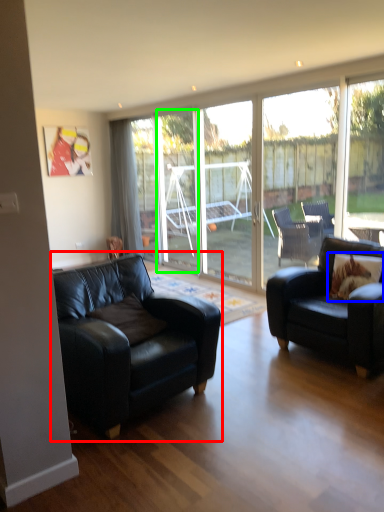
Question: Which object is positioned farthest from studio couch (highlighted by a red box)? Select from pillow (highlighted by a blue box) and glass door (highlighted by a green box).

Choices:
 (A) pillow
 (B) glass door

Answer: (B)